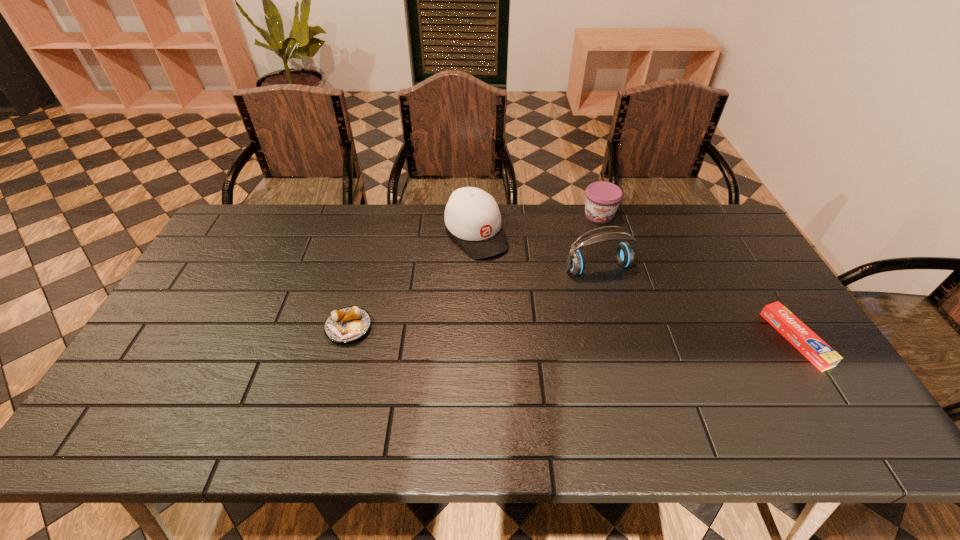
At what (x,y) coordinates should I click in order to perform the action: click on free space on the desktop that is between the fourth tallest object and the toothpaste and is positioned on the ear cups of the headset. Please return your answer as a coordinate pair (x, y). This screenshot has width=960, height=540. Looking at the image, I should click on (636, 335).

The height and width of the screenshot is (540, 960). What are the coordinates of `vacant space on the desktop that is between the fourth tallest object and the shortest object and is positioned on the front label of the third tallest object` in the screenshot? It's located at (606, 334).

Locate an element on the screen. Image resolution: width=960 pixels, height=540 pixels. free space on the desktop that is between the fourth tallest object and the rightmost object and is positioned on the front-facing side of the baseball cap is located at coordinates (550, 333).